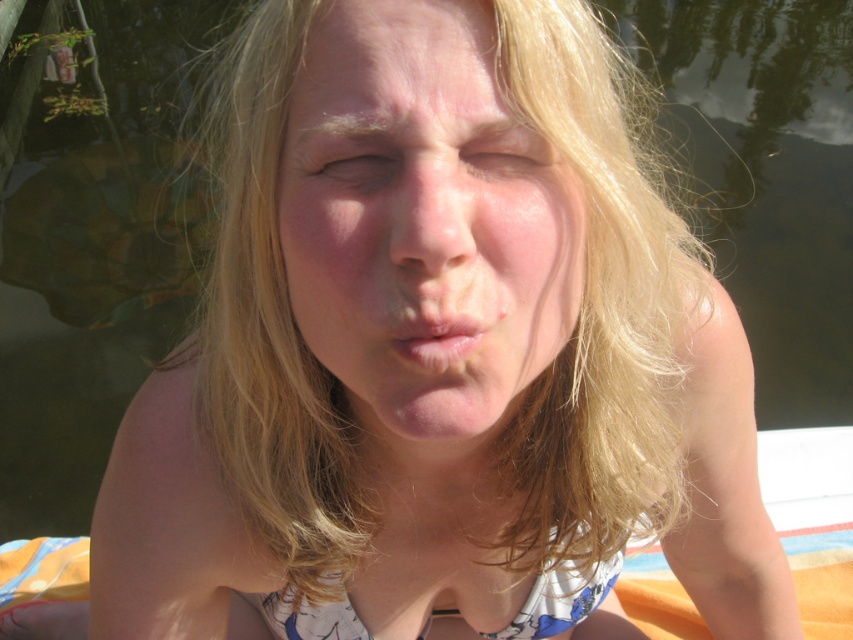
Is matte skin eye at center thinner than light brown skin at center?

No, matte skin eye at center is not thinner than light brown skin at center.

Who is taller, matte skin eye at center or light brown skin at center?

With more height is matte skin eye at center.

Is point (338, 20) farther from camera compared to point (538, 148)?

That is False.

Locate an element on the screen. The image size is (853, 640). matte skin eye at center is located at coordinates (349, 163).

Does blonde hair at center have a greater height compared to smooth skin face at center?

Correct, blonde hair at center is much taller as smooth skin face at center.

Is point (618, 531) in front of point (335, 284)?

No, (618, 531) is further to viewer.

Between point (589, 260) and point (445, 440), which one is positioned in front?

Point (589, 260) is more forward.

Where is `blonde hair at center`? Image resolution: width=853 pixels, height=640 pixels. blonde hair at center is located at coordinates (595, 314).

From the picture: Can you confirm if pale pink lips at center is positioned to the left of light brown skin at center?

Yes, pale pink lips at center is to the left of light brown skin at center.

Who is lower down, pale pink lips at center or light brown skin at center?

pale pink lips at center

Is point (427, 360) positioned behind point (520, 156)?

No.

The image size is (853, 640). Identify the location of pale pink lips at center. (437, 336).